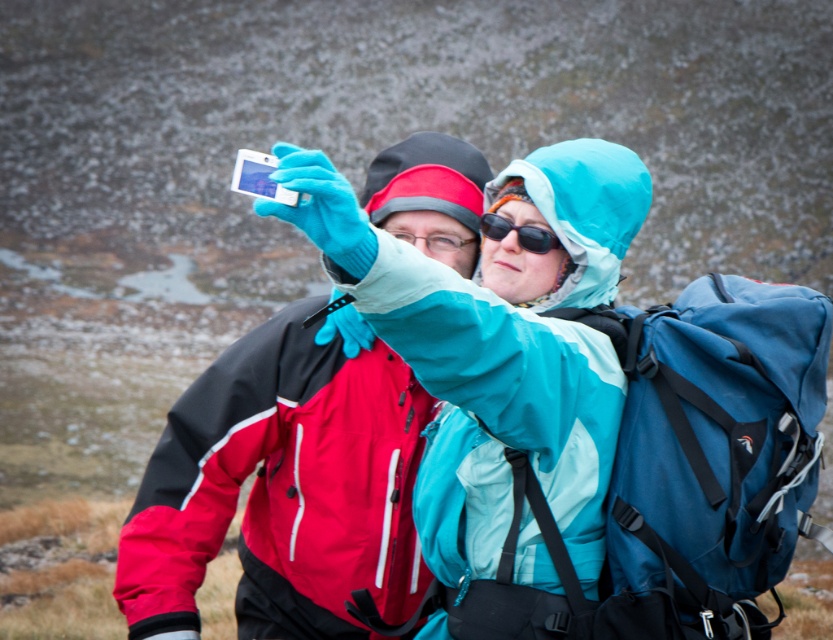
Question: Which object appears closest to the camera in this image?

Choices:
 (A) matte blue jacket at center
 (B) blue fabric backpack at right

Answer: (A)

Question: Does blue fabric backpack at right appear over black plastic sunglasses at center?

Choices:
 (A) yes
 (B) no

Answer: (B)

Question: Which point is farther from the camera taking this photo?

Choices:
 (A) (362, 525)
 (B) (517, 225)

Answer: (A)

Question: Can you confirm if matte blue jacket at center is positioned to the left of blue fabric backpack at right?

Choices:
 (A) yes
 (B) no

Answer: (A)

Question: Is the position of matte blue jacket at center more distant than that of black plastic sunglasses at center?

Choices:
 (A) no
 (B) yes

Answer: (A)

Question: Which point is farther to the camera?

Choices:
 (A) blue fabric backpack at right
 (B) black plastic sunglasses at center

Answer: (B)